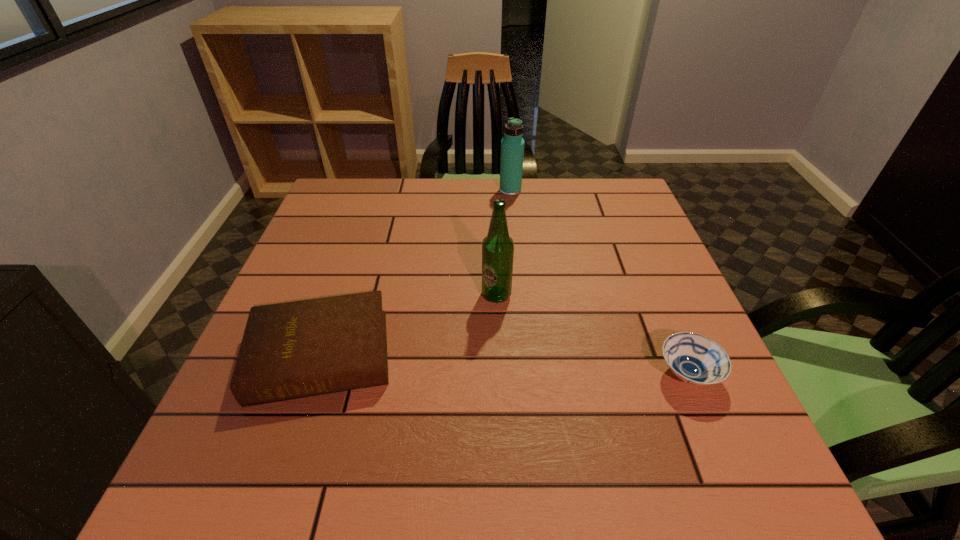
Locate an element on the screen. The image size is (960, 540). free space in the image that satisfies the following two spatial constraints: 1. on the label of the shortest object; 2. on the left side of the third nearest object is located at coordinates (499, 374).

Find the location of `vacant space that satisfies the following two spatial constraints: 1. on the label of the second farthest object; 2. on the right side of the soup bowl`. vacant space that satisfies the following two spatial constraints: 1. on the label of the second farthest object; 2. on the right side of the soup bowl is located at coordinates (499, 374).

Identify the location of free space that satisfies the following two spatial constraints: 1. on the label of the rightmost object; 2. on the right side of the second farthest object. This screenshot has width=960, height=540. (499, 374).